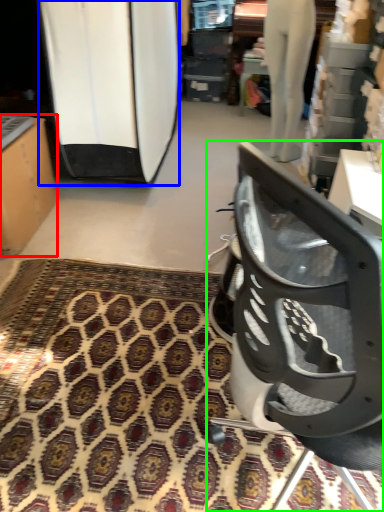
Question: Estimate the real-world distances between objects in this image. Which object is farther from furniture (highlighted by a red box), surfboard (highlighted by a blue box) or chair (highlighted by a green box)?

Choices:
 (A) surfboard
 (B) chair

Answer: (B)